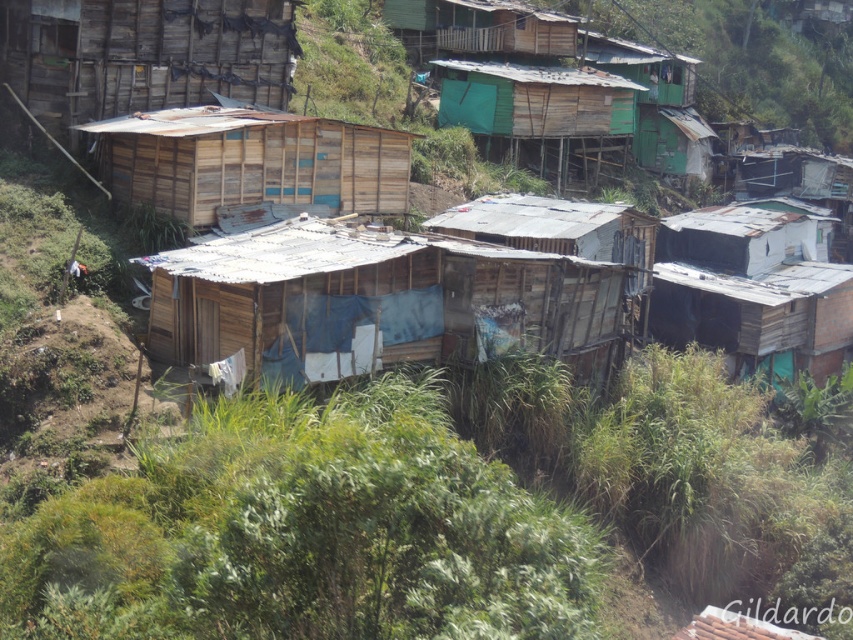
Consider the image. Who is shorter, green grass at center or wooden shack at center?

wooden shack at center is shorter.

In order to click on green grass at center in this screenshot , I will do `click(438, 512)`.

Who is more distant from viewer, (502, 268) or (132, 145)?

The point (132, 145) is behind.

Image resolution: width=853 pixels, height=640 pixels. I want to click on wooden shack at center, so click(376, 300).

Who is lower down, green grass at center or white corrugated metal hut at right?

green grass at center is lower down.

Is point (457, 461) positioned after point (805, 221)?

That is False.

Where is `green grass at center`? This screenshot has height=640, width=853. green grass at center is located at coordinates (438, 512).